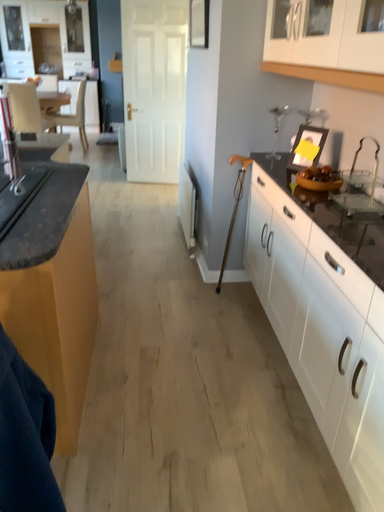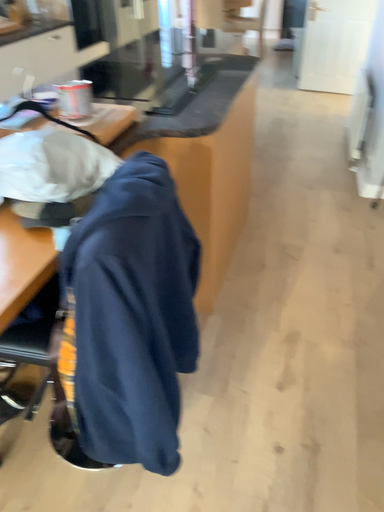
Question: How did the camera likely rotate when shooting the video?

Choices:
 (A) rotated left
 (B) rotated right

Answer: (A)